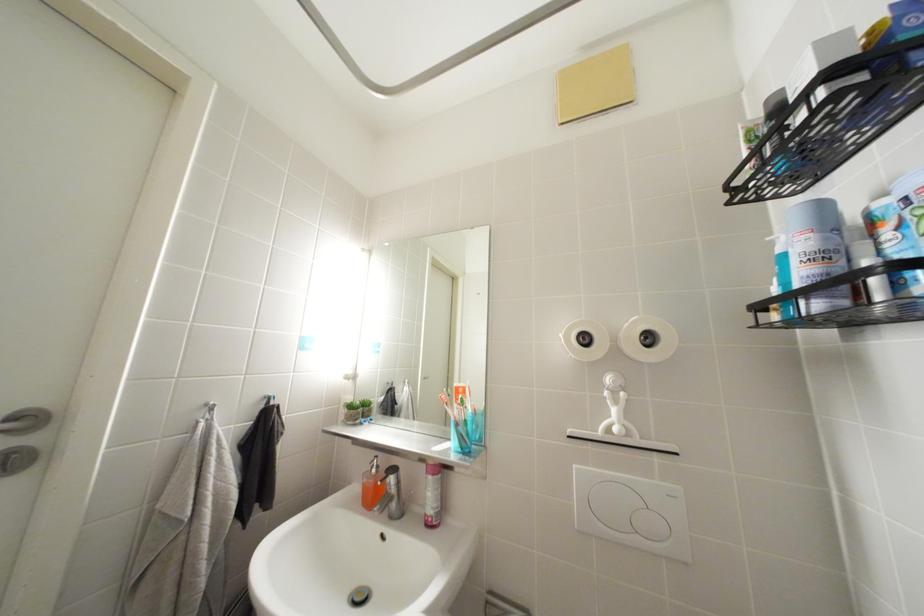
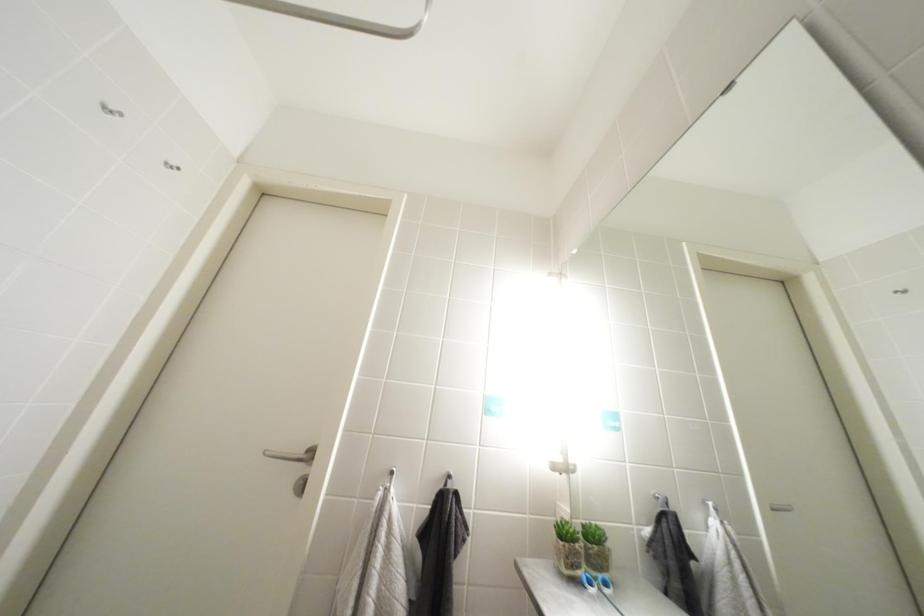
First-person continuous shooting, in which direction is the camera rotating?

The camera's rotation is toward left-up.